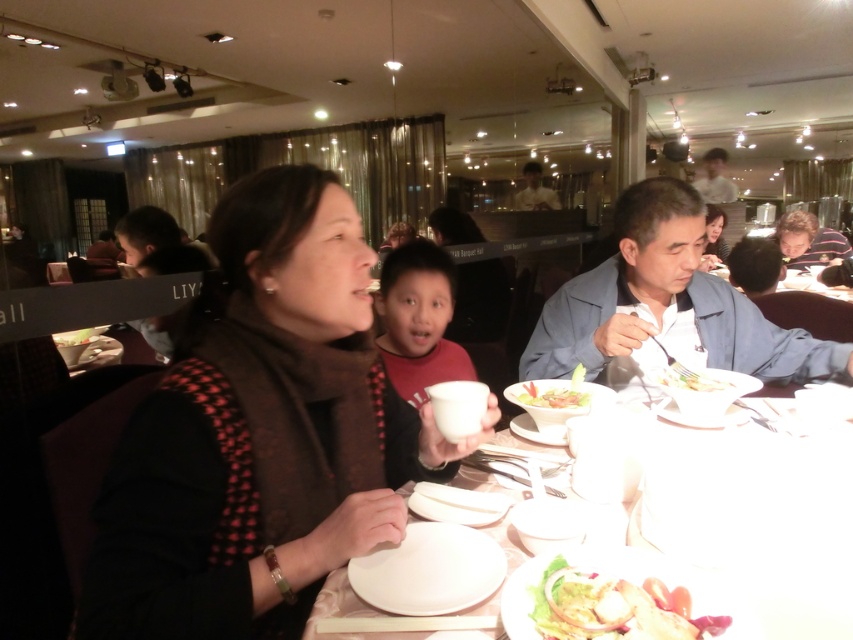
Question: Among these objects, which one is farthest from the camera?

Choices:
 (A) white glossy salad bowl at center
 (B) green leafy salad at center
 (C) shiny green salad at center
 (D) white glossy plate at center

Answer: (A)

Question: Based on their relative distances, which object is farther from the white matte shirt at upper center?

Choices:
 (A) white glossy plate at center
 (B) shiny green salad at center
 (C) matte red shirt at center

Answer: (B)

Question: In this image, where is white glossy shirt at upper center located relative to white glossy salad bowl at center?

Choices:
 (A) below
 (B) above

Answer: (B)

Question: From the image, what is the correct spatial relationship of shiny green salad at center in relation to matte red shirt at center?

Choices:
 (A) above
 (B) below

Answer: (B)

Question: Which of the following is the farthest from the observer?

Choices:
 (A) (718, 161)
 (B) (408, 344)

Answer: (A)

Question: Is matte red shirt at center in front of white matte shirt at upper center?

Choices:
 (A) no
 (B) yes

Answer: (B)